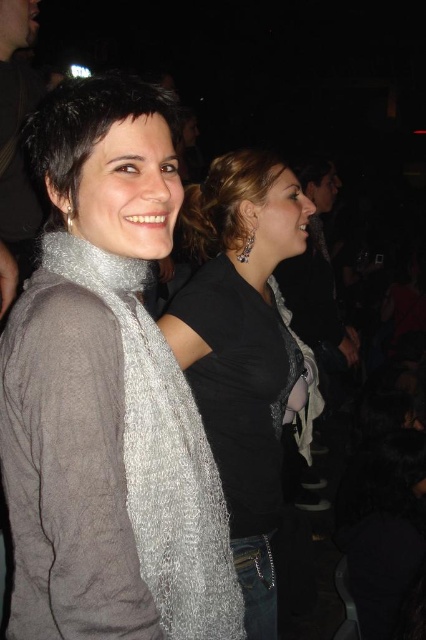
Which is more to the left, silver textured scarf at center or silver metallic scarf at left?

Positioned to the left is silver metallic scarf at left.

Who is taller, silver textured scarf at center or silver metallic scarf at left?

silver textured scarf at center is taller.

Locate an element on the screen. This screenshot has width=426, height=640. silver textured scarf at center is located at coordinates (242, 349).

Where is `silver textured scarf at center`? The height and width of the screenshot is (640, 426). silver textured scarf at center is located at coordinates (242, 349).

Between matte black hair at upper center and silver metallic scarf at left, which one appears on the right side from the viewer's perspective?

From the viewer's perspective, matte black hair at upper center appears more on the right side.

Does matte black hair at upper center have a lesser width compared to silver metallic scarf at left?

Incorrect, matte black hair at upper center's width is not less than silver metallic scarf at left's.

Describe the element at coordinates (88, 124) in the screenshot. This screenshot has height=640, width=426. I see `matte black hair at upper center` at that location.

Image resolution: width=426 pixels, height=640 pixels. Find the location of `matte black hair at upper center`. matte black hair at upper center is located at coordinates (88, 124).

Which is behind, point (212, 186) or point (186, 595)?

Point (212, 186)

Is silver textured scarf at center positioned behind silver textured scarf at left?

Yes, it is.

The width and height of the screenshot is (426, 640). What do you see at coordinates (242, 349) in the screenshot? I see `silver textured scarf at center` at bounding box center [242, 349].

Identify the location of silver textured scarf at center. The width and height of the screenshot is (426, 640). (242, 349).